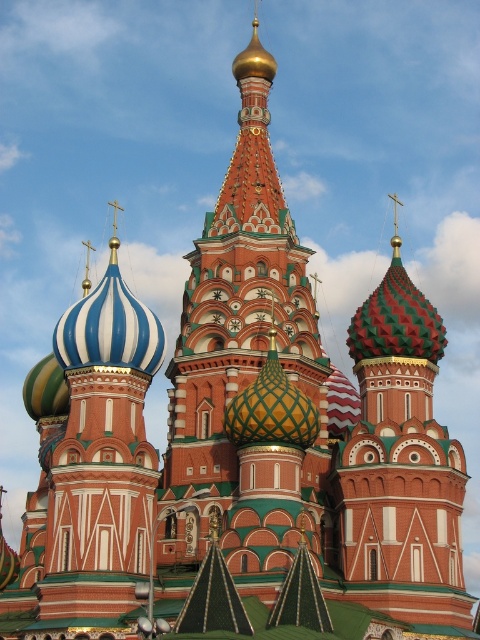
Question: Which object is positioned farthest from the multicolored mosaic dome at center?

Choices:
 (A) red brick onion dome at center
 (B) blue and white striped dome at center

Answer: (B)

Question: Estimate the real-world distances between objects in this image. Which object is farther from the multicolored mosaic dome at center?

Choices:
 (A) red brick onion dome at center
 (B) blue and white striped dome at center

Answer: (B)

Question: Where is red brick onion dome at center located in relation to multicolored mosaic dome at center in the image?

Choices:
 (A) below
 (B) above

Answer: (B)

Question: Can you confirm if blue and white striped dome at center is positioned below multicolored mosaic dome at center?

Choices:
 (A) no
 (B) yes

Answer: (B)

Question: Based on their relative distances, which object is nearer to the multicolored mosaic dome at center?

Choices:
 (A) red brick onion dome at center
 (B) blue and white striped dome at center

Answer: (A)

Question: Can you confirm if blue and white striped dome at center is positioned to the right of multicolored mosaic dome at center?

Choices:
 (A) no
 (B) yes

Answer: (A)